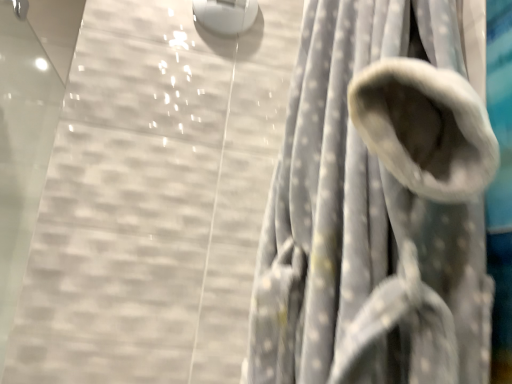
The width and height of the screenshot is (512, 384). Describe the element at coordinates (376, 206) in the screenshot. I see `gray fleece curtain at right` at that location.

Where is `gray fleece curtain at right`? The width and height of the screenshot is (512, 384). gray fleece curtain at right is located at coordinates (376, 206).

Image resolution: width=512 pixels, height=384 pixels. What are the coordinates of `gray fleece curtain at right` in the screenshot? It's located at (376, 206).